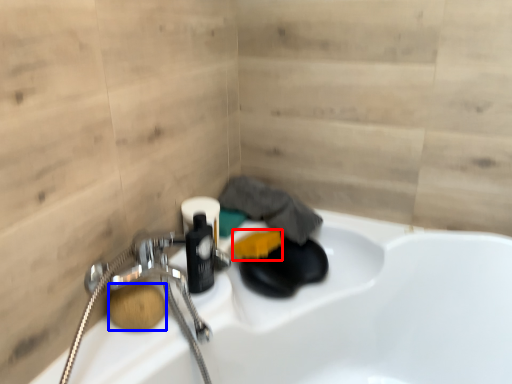
Question: Which of the following is the farthest to the observer, soap (highlighted by a red box) or soap (highlighted by a blue box)?

Choices:
 (A) soap
 (B) soap

Answer: (A)